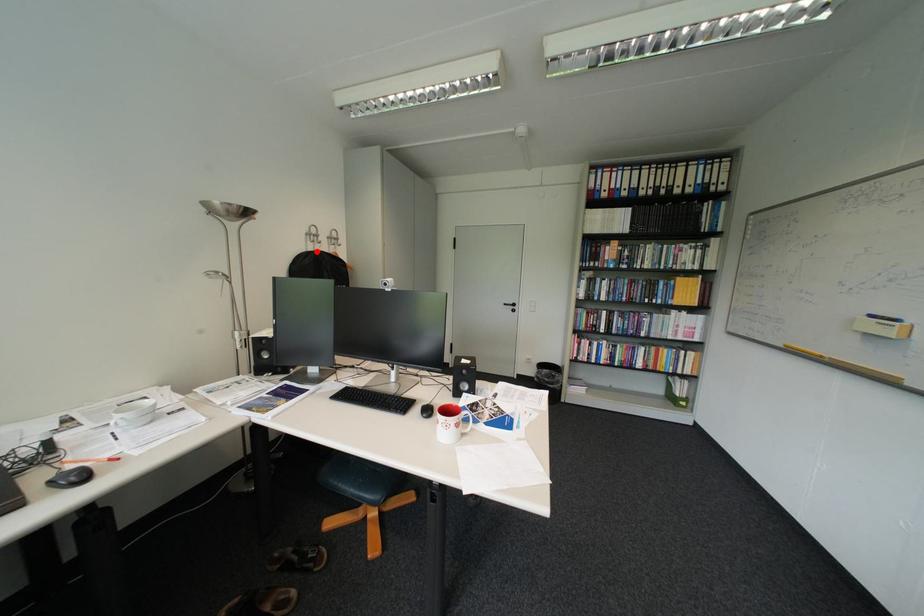
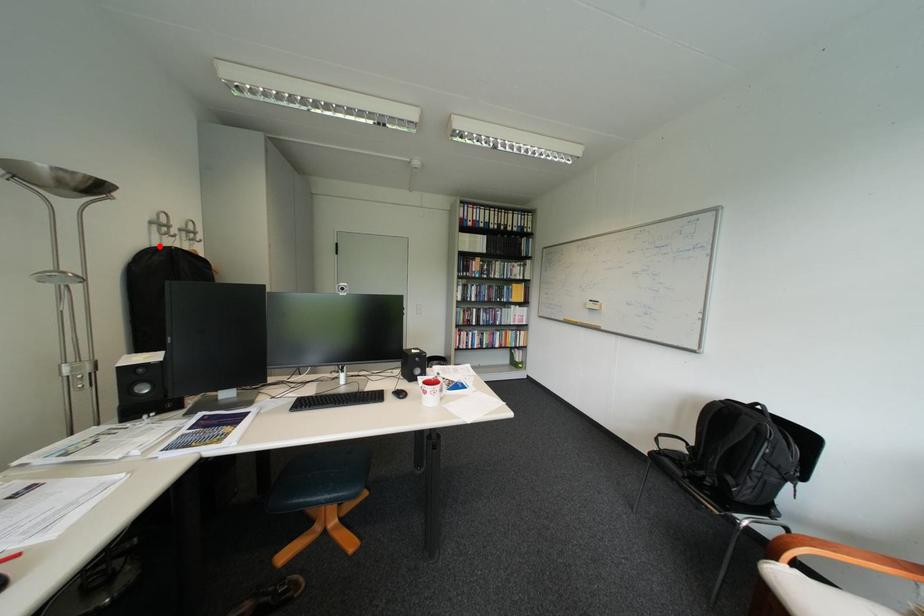
I am providing you with two images of the same scene from different viewpoints. A red point is marked on the first image and another point is marked on the second image. Do the highlighted points in image1 and image2 indicate the same real-world spot?

Yes